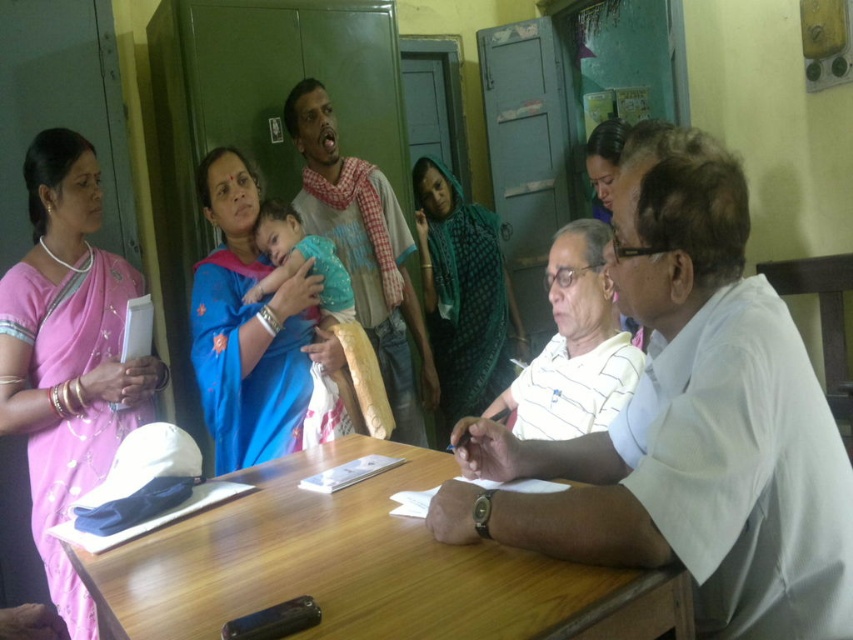
Question: Considering the relative positions of pink silk saree at left and gray cotton shirt at center in the image provided, where is pink silk saree at left located with respect to gray cotton shirt at center?

Choices:
 (A) below
 (B) above

Answer: (A)

Question: Does wooden table at center have a lesser width compared to green textured saree at center?

Choices:
 (A) yes
 (B) no

Answer: (B)

Question: Can you confirm if wooden table at center is positioned to the left of pink silk saree at left?

Choices:
 (A) no
 (B) yes

Answer: (A)

Question: Among these objects, which one is farthest from the camera?

Choices:
 (A) blue silk saree at center
 (B) gray cotton shirt at center

Answer: (B)

Question: Which object is farther from the camera taking this photo?

Choices:
 (A) wooden table at center
 (B) white striped shirt at center
 (C) blue silk saree at center
 (D) gray cotton shirt at center

Answer: (D)

Question: Among these objects, which one is nearest to the camera?

Choices:
 (A) matte green saree at upper center
 (B) gray cotton shirt at center
 (C) pink silk saree at left
 (D) blue silk saree at center

Answer: (C)